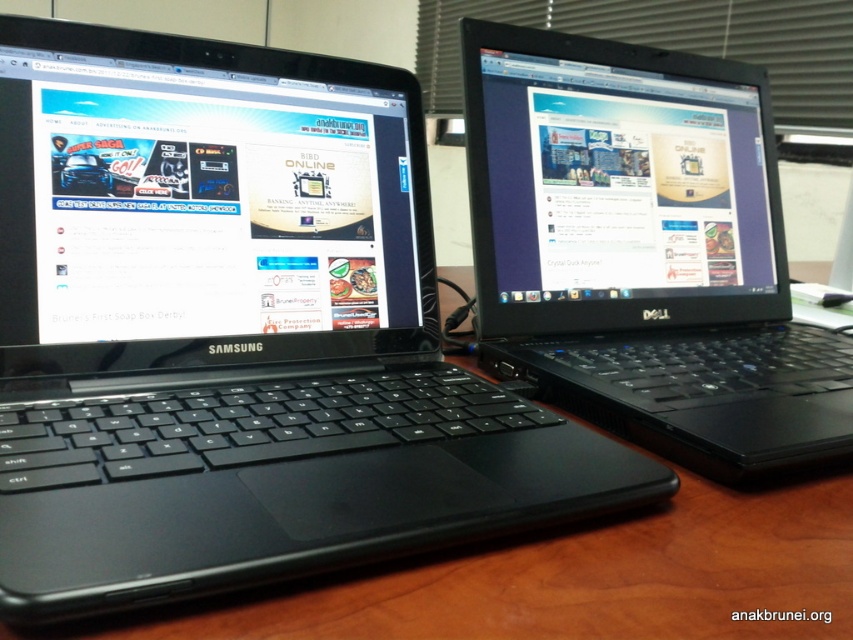
You are standing in front of a desk with two laptops. You need to locate the matte black laptop at left. What are its coordinates?

The matte black laptop at left is located at coordinates point (204,204).

You are organizing a tech fair and need to place the black plastic laptop at center and the matte black screen at upper center on a table. The table has limited space. Based on their sizes, which item can you place first without worrying about space constraints?

The black plastic laptop at center has a lesser width compared to the matte black screen at upper center, so you can place the black plastic laptop at center first since it takes up less space.

You are trying to locate the black plastic laptop at center on a wooden desk. What are the coordinates of its position?

The black plastic laptop at center is located at coordinates point (643, 250).